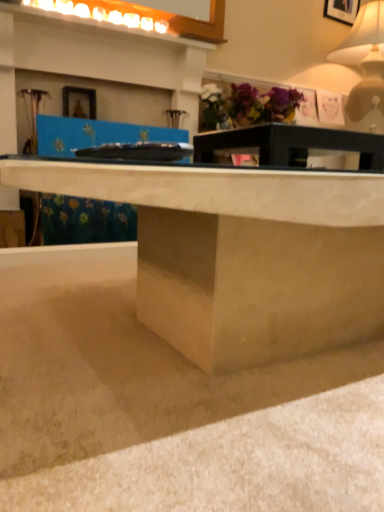
Question: Considering the relative positions of matte black table at center and matte concrete desk at center in the image provided, is matte black table at center to the left or to the right of matte concrete desk at center?

Choices:
 (A) left
 (B) right

Answer: (B)

Question: In the image, is matte black table at center positioned in front of or behind matte concrete desk at center?

Choices:
 (A) behind
 (B) front

Answer: (A)

Question: Estimate the real-world distances between objects in this image. Which object is farther from the matte purple flowers at upper center?

Choices:
 (A) matte concrete desk at center
 (B) matte white table lamp at upper right
 (C) wooden picture frame at upper center
 (D) smooth concrete at lower center
 (E) matte black table at center

Answer: (D)

Question: Which object is the farthest from the matte white table lamp at upper right?

Choices:
 (A) matte purple flowers at upper center
 (B) smooth concrete at lower center
 (C) wooden picture frame at upper center
 (D) matte black table at center
 (E) matte concrete desk at center

Answer: (B)